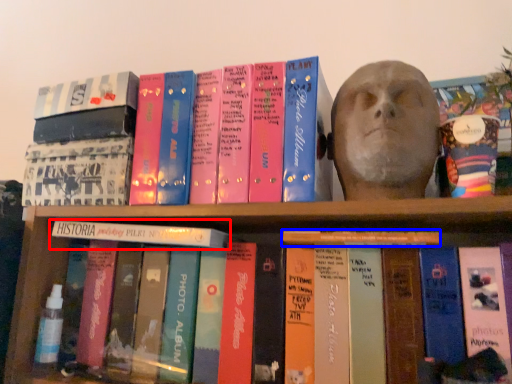
Question: Which point is further to the camera, book (highlighted by a red box) or book (highlighted by a blue box)?

Choices:
 (A) book
 (B) book

Answer: (A)